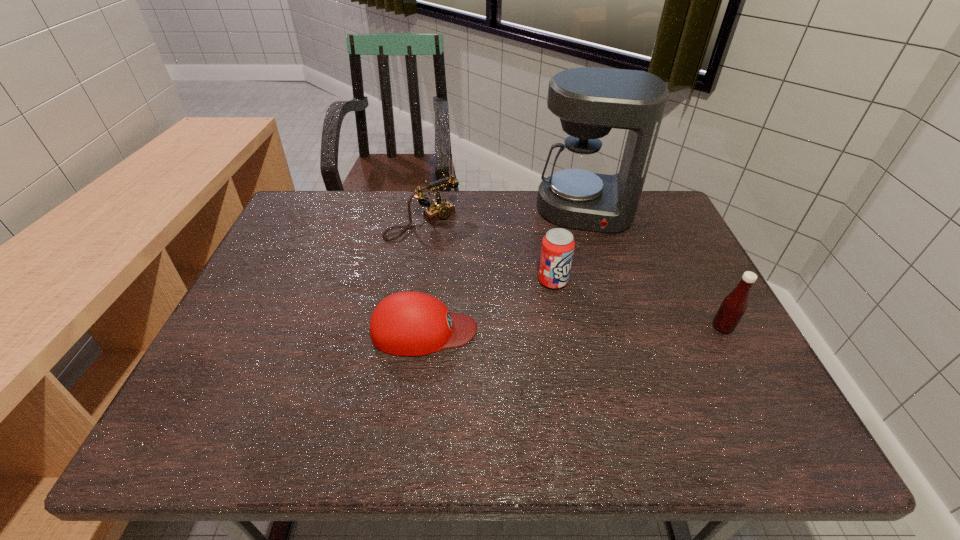
Where is `vacant space located on the surface of the soda can`? The image size is (960, 540). vacant space located on the surface of the soda can is located at coordinates (651, 359).

The height and width of the screenshot is (540, 960). What are the coordinates of `free space located 0.100m on the surface of the soda can` in the screenshot? It's located at tap(593, 313).

I want to click on blank space located on the surface of the soda can, so click(593, 313).

Identify the location of vacant space situated on the front-facing side of the tallest object. Image resolution: width=960 pixels, height=540 pixels. (573, 337).

At what (x,y) coordinates should I click in order to perform the action: click on free space located 0.400m on the front-facing side of the tallest object. Please return your answer as a coordinate pair (x, y). The height and width of the screenshot is (540, 960). Looking at the image, I should click on (573, 340).

This screenshot has height=540, width=960. In order to click on vacant space located 0.050m on the front-facing side of the tallest object in this screenshot , I will do `click(581, 246)`.

Locate an element on the screen. telephone that is at the far edge is located at coordinates (439, 209).

Locate an element on the screen. The width and height of the screenshot is (960, 540). coffee maker that is at the far edge is located at coordinates (590, 101).

This screenshot has height=540, width=960. Identify the location of Tabasco sauce at the right edge. (734, 305).

You are a GUI agent. You are given a task and a screenshot of the screen. Output one action in this format:
    pyautogui.click(x=<x>, y=<y>)
    Task: Click on the coffee maker at the right edge
    The image size is (960, 540).
    Given the screenshot: What is the action you would take?
    pyautogui.click(x=590, y=101)